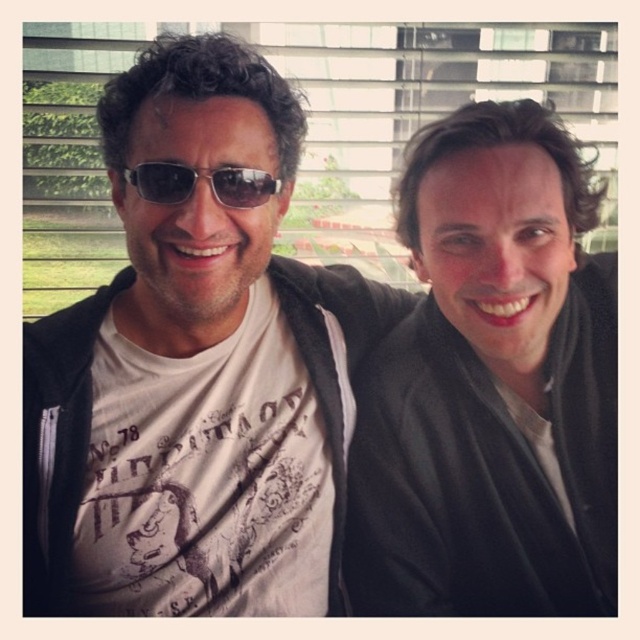
You are trying to decide which item is closer to the right edge of the image. You see the matte black jacket at center and the black plastic sunglasses at center. Based on their positions, which one is positioned more to the right?

The matte black jacket at center is to the right of the black plastic sunglasses at center, so the matte black jacket at center is positioned more to the right.

You are trying to decide whether to place a new accessory on the shelf next to the matte black jacket at left and the black plastic sunglasses at center. The shelf has limited vertical space. Based on their positions in the image, which object should you place first to maximize shelf space?

The matte black jacket at left is below the black plastic sunglasses at center, so placing the sunglasses first will allow the jacket to be placed underneath, maximizing shelf space.